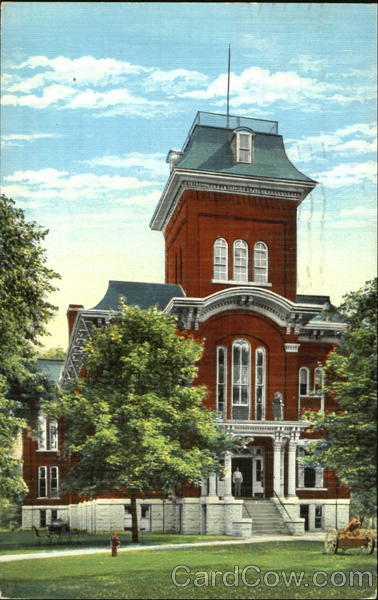
Where is `old buggy decoration`? old buggy decoration is located at coordinates (349, 543).